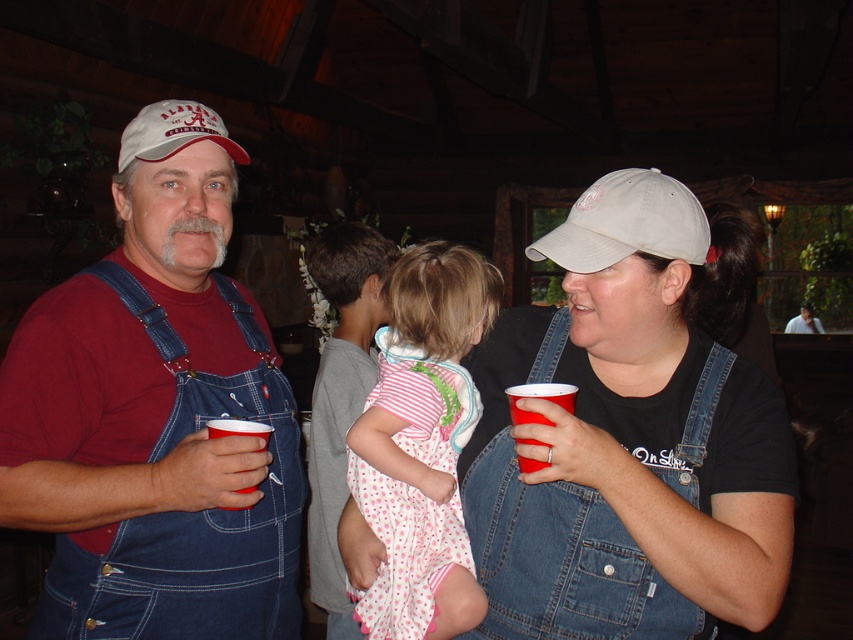
Can you confirm if polka dot fabric dress at center is wider than white fabric baseball cap at center?

No.

Between point (389, 342) and point (605, 186), which one is positioned in front?

Point (605, 186) is in front.

The height and width of the screenshot is (640, 853). In order to click on polka dot fabric dress at center in this screenshot , I will do `click(422, 444)`.

Is point (515, 412) positioned after point (228, 419)?

No, it is in front of (228, 419).

Does red plastic cup at lower center appear on the right side of red plastic cup at lower left?

Correct, you'll find red plastic cup at lower center to the right of red plastic cup at lower left.

Is point (572, 410) closer to viewer compared to point (235, 433)?

Yes, it is in front of point (235, 433).

Where is `red plastic cup at lower center`? red plastic cup at lower center is located at coordinates (538, 397).

Does denim overalls at center have a greater height compared to white fabric baseball cap at center?

Yes.

Can you confirm if denim overalls at center is positioned below white fabric baseball cap at center?

Yes, denim overalls at center is below white fabric baseball cap at center.

This screenshot has height=640, width=853. What do you see at coordinates (630, 435) in the screenshot?
I see `denim overalls at center` at bounding box center [630, 435].

Locate an element on the screen. denim overalls at center is located at coordinates (x=630, y=435).